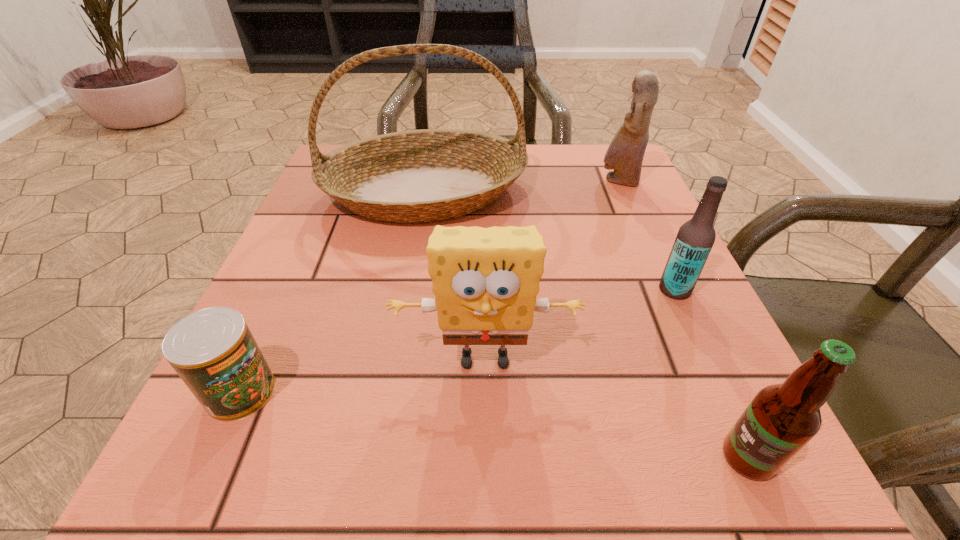
Locate an element on the screen. The image size is (960, 540). free spot located on the face of the sponge is located at coordinates (486, 508).

Image resolution: width=960 pixels, height=540 pixels. In order to click on vacant space located on the label of the third farthest object in this screenshot , I will do `click(472, 289)`.

Where is `vacant space located 0.050m on the label of the third farthest object`? The image size is (960, 540). vacant space located 0.050m on the label of the third farthest object is located at coordinates (629, 289).

The height and width of the screenshot is (540, 960). Find the location of `vacant area located 0.200m on the label of the third farthest object`. vacant area located 0.200m on the label of the third farthest object is located at coordinates (539, 289).

This screenshot has width=960, height=540. I want to click on free space located on the label of the nearer beer bottle, so click(622, 457).

This screenshot has height=540, width=960. I want to click on free spot located 0.070m on the label of the nearer beer bottle, so click(663, 457).

Identify the location of vacant point located 0.360m on the label of the nearer beer bottle. The height and width of the screenshot is (540, 960). (420, 457).

Where is `blank area located on the right of the can`? Image resolution: width=960 pixels, height=540 pixels. blank area located on the right of the can is located at coordinates (363, 392).

The height and width of the screenshot is (540, 960). In order to click on basket at the far edge in this screenshot , I will do `click(425, 175)`.

Locate an element on the screen. figurine that is positioned at the far edge is located at coordinates (625, 154).